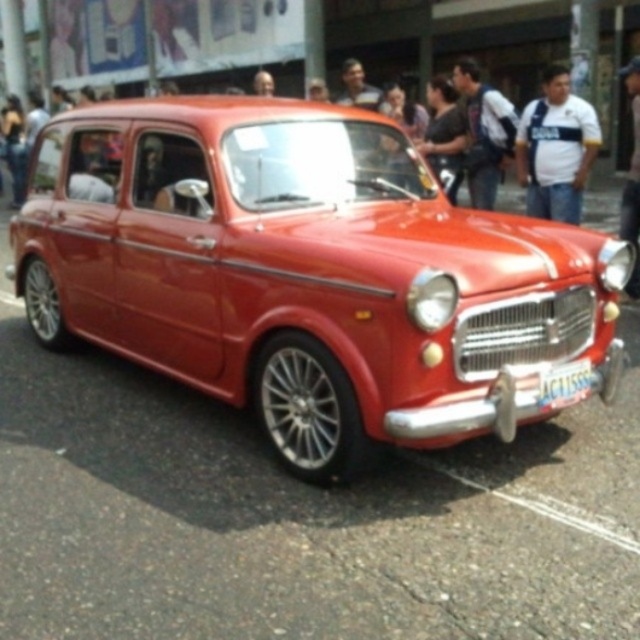
Does white striped shirt at center have a lesser width compared to smooth leather jacket at upper right?

Yes.

Which is behind, point (545, 145) or point (627, 88)?

The point (627, 88) is more distant.

Is point (525, 148) less distant than point (637, 234)?

No, it is not.

This screenshot has width=640, height=640. In order to click on white striped shirt at center in this screenshot , I will do `click(556, 148)`.

Does point (582, 337) come farther from viewer compared to point (490, 166)?

No, (582, 337) is closer to viewer.

Who is more distant from viewer, (x=346, y=227) or (x=472, y=120)?

Positioned behind is point (x=472, y=120).

The width and height of the screenshot is (640, 640). I want to click on shiny red car at center, so click(307, 273).

Which is behind, point (227, 204) or point (547, 394)?

The point (227, 204) is more distant.

At what (x,y) coordinates should I click in order to perform the action: click on shiny red car at center. Please return your answer as a coordinate pair (x, y). Image resolution: width=640 pixels, height=640 pixels. Looking at the image, I should click on (307, 273).

Find the location of `shiny red car at center`. shiny red car at center is located at coordinates (307, 273).